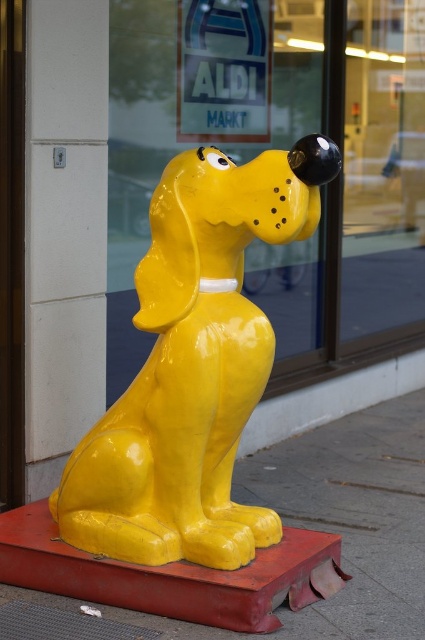
Is glossy glass shop window at upper center smaller than glossy yellow dog at center?

Actually, glossy glass shop window at upper center might be larger than glossy yellow dog at center.

Which is in front, point (299, 24) or point (388, 451)?

Positioned in front is point (388, 451).

Between point (359, 326) and point (422, 444), which one is positioned in front?

Point (422, 444)

Locate an element on the screen. The width and height of the screenshot is (425, 640). glossy glass shop window at upper center is located at coordinates (x=280, y=147).

Is glossy glass shop window at upper center wider than matte yellow dog at center?

Correct, the width of glossy glass shop window at upper center exceeds that of matte yellow dog at center.

Find the location of a particular element. The width and height of the screenshot is (425, 640). glossy glass shop window at upper center is located at coordinates (280, 147).

I want to click on glossy glass shop window at upper center, so click(x=280, y=147).

Is matte yellow dog at center closer to camera compared to glossy yellow dog at center?

That is False.

Is matte yellow dog at center bigger than glossy yellow dog at center?

Incorrect, matte yellow dog at center is not larger than glossy yellow dog at center.

The width and height of the screenshot is (425, 640). Find the location of `matte yellow dog at center`. matte yellow dog at center is located at coordinates (192, 365).